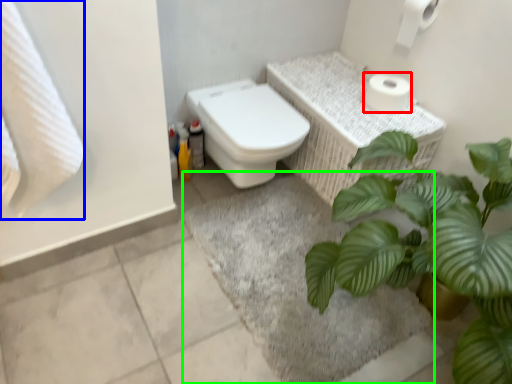
Question: Considering the real-world distances, which object is farthest from toilet paper (highlighted by a red box)? bath towel (highlighted by a blue box) or bath mat (highlighted by a green box)?

Choices:
 (A) bath towel
 (B) bath mat

Answer: (A)